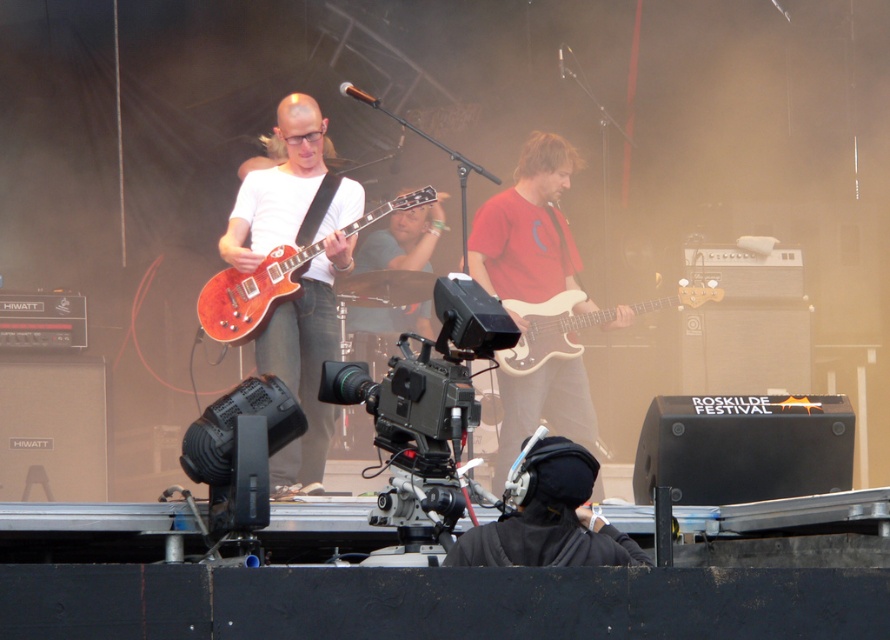
Question: Among these points, which one is farthest from the camera?

Choices:
 (A) (580, 346)
 (B) (228, 332)
 (C) (241, 212)
 (D) (567, 531)

Answer: (A)

Question: Can you confirm if red matte guitar at center is thinner than white matte bass guitar at center?

Choices:
 (A) no
 (B) yes

Answer: (B)

Question: Can you confirm if red matte guitar at center is positioned above glossy wood guitar at center?

Choices:
 (A) no
 (B) yes

Answer: (B)

Question: Is matte black guitar at center below glossy wood guitar at center?

Choices:
 (A) yes
 (B) no

Answer: (A)

Question: Which is nearer to the red matte guitar at center?

Choices:
 (A) glossy wood guitar at center
 (B) white matte bass guitar at center
 (C) black matte headphones at center
 (D) matte black guitar at center

Answer: (B)

Question: Which point appears closest to the camera in this image?

Choices:
 (A) (575, 328)
 (B) (269, 184)
 (C) (572, 547)

Answer: (C)